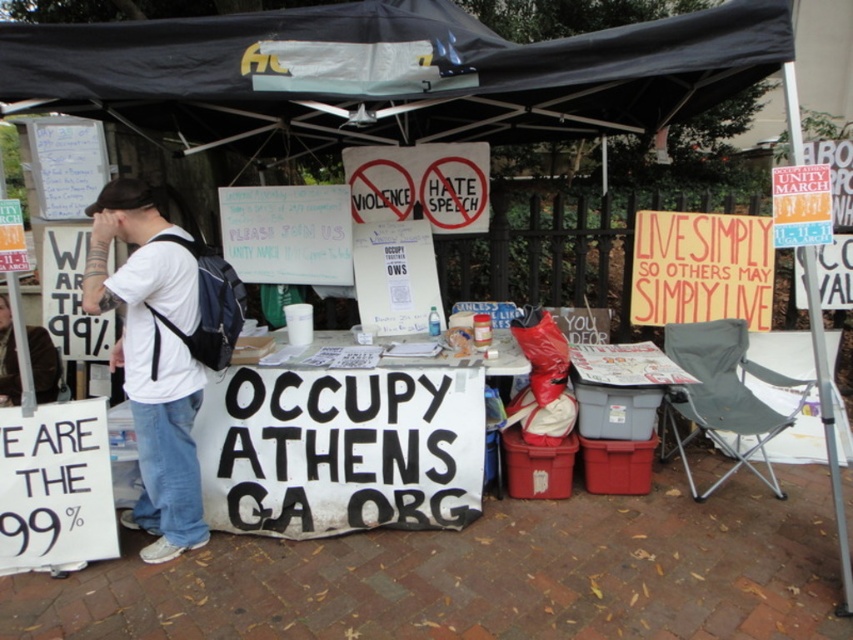
Based on the scene description and the provided objects, what object is located at the coordinates point (395, 81)?

The object located at point (395, 81) is the black fabric canopy at upper center.